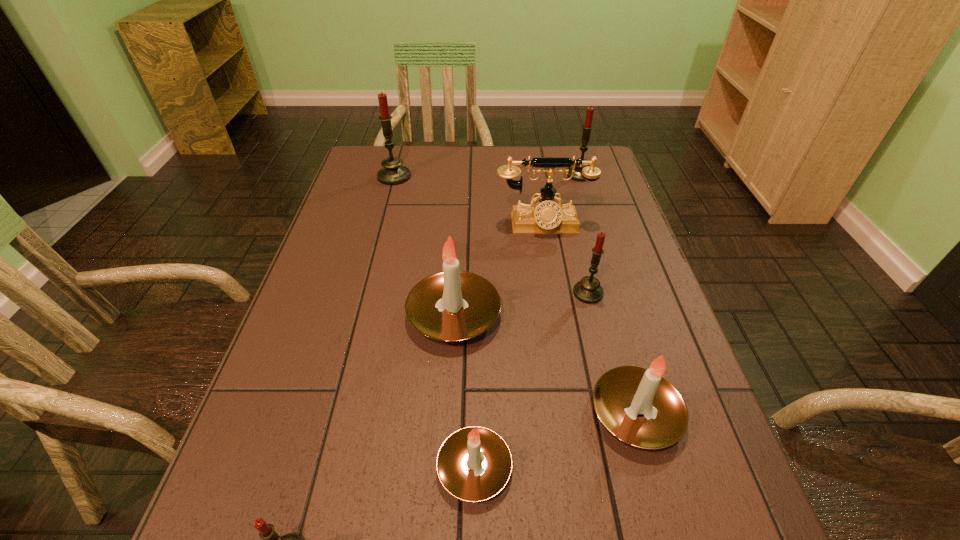
Image resolution: width=960 pixels, height=540 pixels. Identify the location of vacant region that satisfies the following two spatial constraints: 1. on the dial of the telephone; 2. on the left side of the second biggest white candle. (574, 414).

Where is `free location that satisfies the following two spatial constraints: 1. on the front side of the biggest white candle; 2. on the left side of the tallest candle`? This screenshot has width=960, height=540. free location that satisfies the following two spatial constraints: 1. on the front side of the biggest white candle; 2. on the left side of the tallest candle is located at coordinates (358, 315).

You are a GUI agent. You are given a task and a screenshot of the screen. Output one action in this format:
    pyautogui.click(x=<x>, y=<y>)
    Task: Click on the blank space that satisfies the following two spatial constraints: 1. on the dial of the second biggest white candle; 2. on the right side of the third farthest object
    
    Given the screenshot: What is the action you would take?
    pyautogui.click(x=574, y=414)